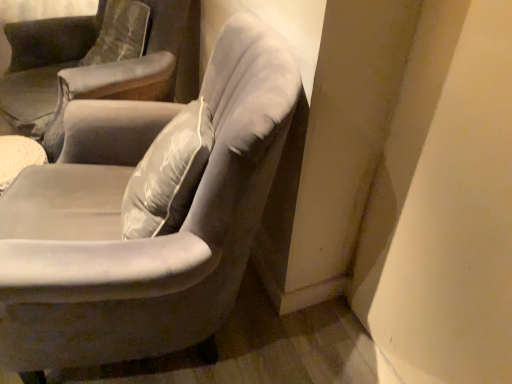
How much space does velvet gray armchair at upper left, which appears as the second chair when viewed from the front, occupy horizontally?

It is 35.10 inches.

Find the location of `velvet gray armchair at upper left, which appears as the second chair when viewed from the front`. velvet gray armchair at upper left, which appears as the second chair when viewed from the front is located at coordinates (87, 65).

The height and width of the screenshot is (384, 512). What do you see at coordinates (87, 65) in the screenshot?
I see `velvet gray armchair at upper left, the 1th chair in the back-to-front sequence` at bounding box center [87, 65].

Measure the distance between velvet gray armchair at upper left, the 1th chair in the back-to-front sequence, and camera.

4.78 feet.

Find the location of a particular element. This screenshot has height=384, width=512. velvet gray armchair at center, the second chair when ordered from back to front is located at coordinates (143, 239).

Describe the element at coordinates (143, 239) in the screenshot. I see `velvet gray armchair at center, the second chair when ordered from back to front` at that location.

What are the coordinates of `velvet gray armchair at upper left, which appears as the second chair when viewed from the front` in the screenshot? It's located at (87, 65).

Which object is positioned more to the left, velvet gray armchair at upper left, which appears as the second chair when viewed from the front, or velvet gray armchair at center, placed as the first chair when sorted from front to back?

velvet gray armchair at upper left, which appears as the second chair when viewed from the front.

Is velvet gray armchair at upper left, the 1th chair in the back-to-front sequence, positioned in front of velvet gray armchair at center, the second chair when ordered from back to front?

That is False.

Is point (71, 37) positioned in front of point (15, 254)?

No, (71, 37) is behind (15, 254).

From the image's perspective, is velvet gray armchair at upper left, the 1th chair in the back-to-front sequence, above or below velvet gray armchair at center, the second chair when ordered from back to front?

Clearly, from the image's perspective, velvet gray armchair at upper left, the 1th chair in the back-to-front sequence, is above velvet gray armchair at center, the second chair when ordered from back to front.

From a real-world perspective, is velvet gray armchair at upper left, the 1th chair in the back-to-front sequence, positioned over velvet gray armchair at center, placed as the first chair when sorted from front to back, based on gravity?

Yes, from a real-world perspective, velvet gray armchair at upper left, the 1th chair in the back-to-front sequence, is above velvet gray armchair at center, placed as the first chair when sorted from front to back.

Which of these two, velvet gray armchair at upper left, which appears as the second chair when viewed from the front, or velvet gray armchair at center, the second chair when ordered from back to front, is thinner?

With smaller width is velvet gray armchair at center, the second chair when ordered from back to front.

Considering the sizes of objects velvet gray armchair at upper left, which appears as the second chair when viewed from the front, and velvet gray armchair at center, placed as the first chair when sorted from front to back, in the image provided, who is shorter, velvet gray armchair at upper left, which appears as the second chair when viewed from the front, or velvet gray armchair at center, placed as the first chair when sorted from front to back,?

velvet gray armchair at upper left, which appears as the second chair when viewed from the front.

Considering the sizes of velvet gray armchair at upper left, the 1th chair in the back-to-front sequence, and velvet gray armchair at center, placed as the first chair when sorted from front to back, in the image, is velvet gray armchair at upper left, the 1th chair in the back-to-front sequence, bigger or smaller than velvet gray armchair at center, placed as the first chair when sorted from front to back,?

velvet gray armchair at upper left, the 1th chair in the back-to-front sequence, is bigger than velvet gray armchair at center, placed as the first chair when sorted from front to back.

Is velvet gray armchair at upper left, which appears as the second chair when viewed from the front, inside the boundaries of velvet gray armchair at center, the second chair when ordered from back to front, or outside?

velvet gray armchair at upper left, which appears as the second chair when viewed from the front, lies outside velvet gray armchair at center, the second chair when ordered from back to front.

Would you say velvet gray armchair at upper left, the 1th chair in the back-to-front sequence, is a long distance from velvet gray armchair at center, the second chair when ordered from back to front?

No, there isn't a large distance between velvet gray armchair at upper left, the 1th chair in the back-to-front sequence, and velvet gray armchair at center, the second chair when ordered from back to front.

Is velvet gray armchair at upper left, which appears as the second chair when viewed from the front, facing towards velvet gray armchair at center, placed as the first chair when sorted from front to back?

No, velvet gray armchair at upper left, which appears as the second chair when viewed from the front, is not facing towards velvet gray armchair at center, placed as the first chair when sorted from front to back.

Measure the distance from velvet gray armchair at upper left, the 1th chair in the back-to-front sequence, to velvet gray armchair at center, the second chair when ordered from back to front.

The distance of velvet gray armchair at upper left, the 1th chair in the back-to-front sequence, from velvet gray armchair at center, the second chair when ordered from back to front, is 24.80 inches.

Where is `chair below the velvet gray armchair at upper left, the 1th chair in the back-to-front sequence (from a real-world perspective)`? chair below the velvet gray armchair at upper left, the 1th chair in the back-to-front sequence (from a real-world perspective) is located at coordinates (143, 239).

Between velvet gray armchair at center, placed as the first chair when sorted from front to back, and velvet gray armchair at upper left, the 1th chair in the back-to-front sequence, which one appears on the right side from the viewer's perspective?

From the viewer's perspective, velvet gray armchair at center, placed as the first chair when sorted from front to back, appears more on the right side.

Is velvet gray armchair at center, placed as the first chair when sorted from front to back, positioned behind velvet gray armchair at upper left, which appears as the second chair when viewed from the front?

No, the depth of velvet gray armchair at center, placed as the first chair when sorted from front to back, is less than that of velvet gray armchair at upper left, which appears as the second chair when viewed from the front.

Considering the points (262, 131) and (175, 7), which point is in front, point (262, 131) or point (175, 7)?

The point (262, 131) is closer.

From the image's perspective, relative to velvet gray armchair at upper left, which appears as the second chair when viewed from the front, is velvet gray armchair at center, placed as the first chair when sorted from front to back, above or below?

Based on their image positions, velvet gray armchair at center, placed as the first chair when sorted from front to back, is located beneath velvet gray armchair at upper left, which appears as the second chair when viewed from the front.

From a real-world perspective, is velvet gray armchair at center, placed as the first chair when sorted from front to back, physically below velvet gray armchair at upper left, the 1th chair in the back-to-front sequence?

Indeed, from a real-world perspective, velvet gray armchair at center, placed as the first chair when sorted from front to back, is positioned beneath velvet gray armchair at upper left, the 1th chair in the back-to-front sequence.

Does velvet gray armchair at center, the second chair when ordered from back to front, have a greater width compared to velvet gray armchair at upper left, which appears as the second chair when viewed from the front?

No, velvet gray armchair at center, the second chair when ordered from back to front, is not wider than velvet gray armchair at upper left, which appears as the second chair when viewed from the front.

Is velvet gray armchair at center, the second chair when ordered from back to front, shorter than velvet gray armchair at upper left, the 1th chair in the back-to-front sequence?

No.

Who is bigger, velvet gray armchair at center, placed as the first chair when sorted from front to back, or velvet gray armchair at upper left, the 1th chair in the back-to-front sequence?

velvet gray armchair at upper left, the 1th chair in the back-to-front sequence.

Is velvet gray armchair at upper left, which appears as the second chair when viewed from the front, surrounded by velvet gray armchair at center, the second chair when ordered from back to front?

No.

Does velvet gray armchair at center, the second chair when ordered from back to front, touch velvet gray armchair at upper left, the 1th chair in the back-to-front sequence?

velvet gray armchair at center, the second chair when ordered from back to front, is not next to velvet gray armchair at upper left, the 1th chair in the back-to-front sequence, and they're not touching.

Based on the photo, is velvet gray armchair at center, the second chair when ordered from back to front, positioned with its back to velvet gray armchair at upper left, which appears as the second chair when viewed from the front?

No.

Measure the distance from velvet gray armchair at center, the second chair when ordered from back to front, to velvet gray armchair at upper left, the 1th chair in the back-to-front sequence.

velvet gray armchair at center, the second chair when ordered from back to front, and velvet gray armchair at upper left, the 1th chair in the back-to-front sequence, are 24.80 inches apart.

Where is `chair below the velvet gray armchair at upper left, which appears as the second chair when viewed from the front (from a real-world perspective)`? Image resolution: width=512 pixels, height=384 pixels. chair below the velvet gray armchair at upper left, which appears as the second chair when viewed from the front (from a real-world perspective) is located at coordinates (143, 239).

Where is `chair on the left of velvet gray armchair at center, the second chair when ordered from back to front`? The width and height of the screenshot is (512, 384). chair on the left of velvet gray armchair at center, the second chair when ordered from back to front is located at coordinates (87, 65).

In the image, there is a velvet gray armchair at upper left, the 1th chair in the back-to-front sequence. In order to click on chair below it (from a real-world perspective) in this screenshot , I will do `click(143, 239)`.